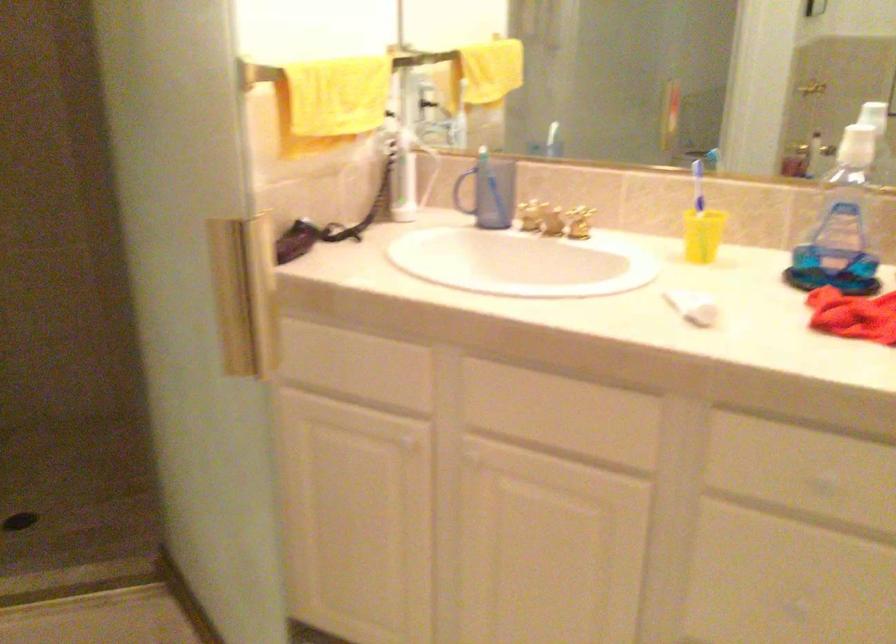
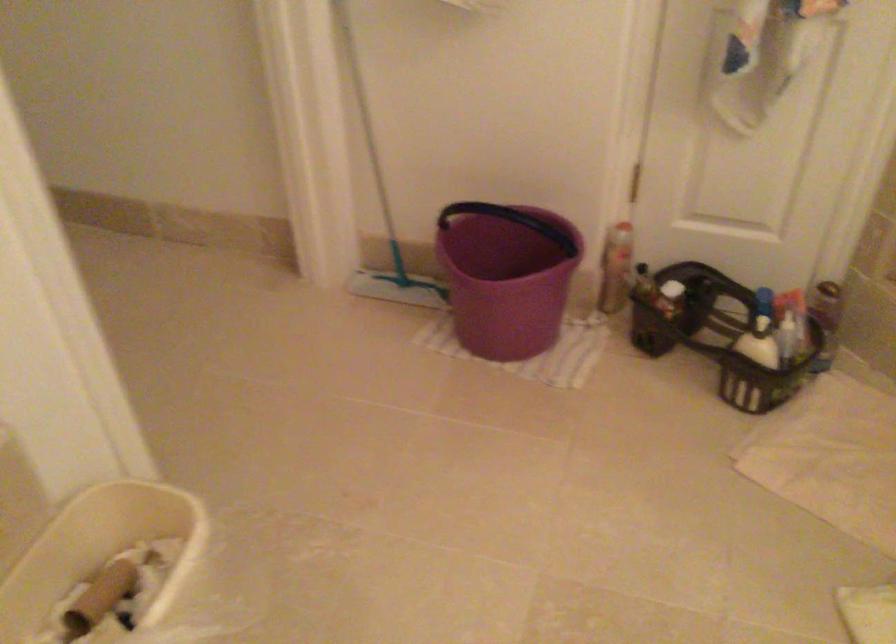
First-person continuous shooting, in which direction is the camera rotating?

The rotation direction of the camera is left-down.